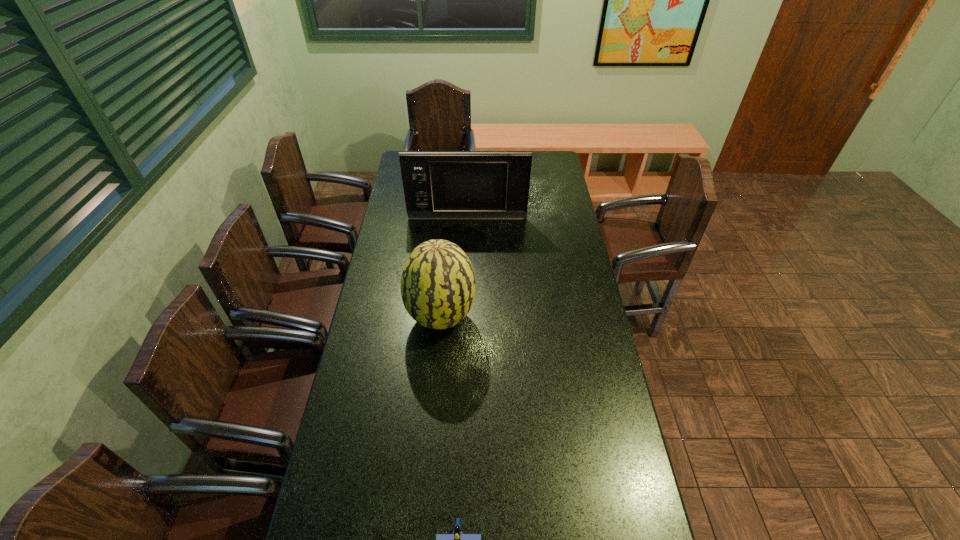
Find the location of a particular element. The image size is (960, 540). watermelon is located at coordinates (438, 287).

I want to click on microwave oven, so click(437, 185).

You are a GUI agent. You are given a task and a screenshot of the screen. Output one action in this format:
    pyautogui.click(x=<x>, y=<y>)
    Task: Click on the free space located 0.380m on the right of the second farthest object
    This screenshot has height=540, width=960.
    Given the screenshot: What is the action you would take?
    pyautogui.click(x=584, y=319)

Where is `vacant area situated 0.200m on the front panel of the farthest object`? The height and width of the screenshot is (540, 960). vacant area situated 0.200m on the front panel of the farthest object is located at coordinates (467, 250).

The width and height of the screenshot is (960, 540). I want to click on watermelon located at the left edge, so click(438, 287).

I want to click on microwave oven at the left edge, so click(437, 185).

The width and height of the screenshot is (960, 540). In the image, there is a desktop. Identify the location of vacant area at the left edge. (420, 223).

In the image, there is a desktop. Where is `vacant space at the right edge`? This screenshot has width=960, height=540. vacant space at the right edge is located at coordinates (567, 194).

The width and height of the screenshot is (960, 540). Identify the location of object that stands as the second closest to the nearest object. (437, 185).

Image resolution: width=960 pixels, height=540 pixels. I want to click on object that is the closest one to the second farthest object, so click(437, 185).